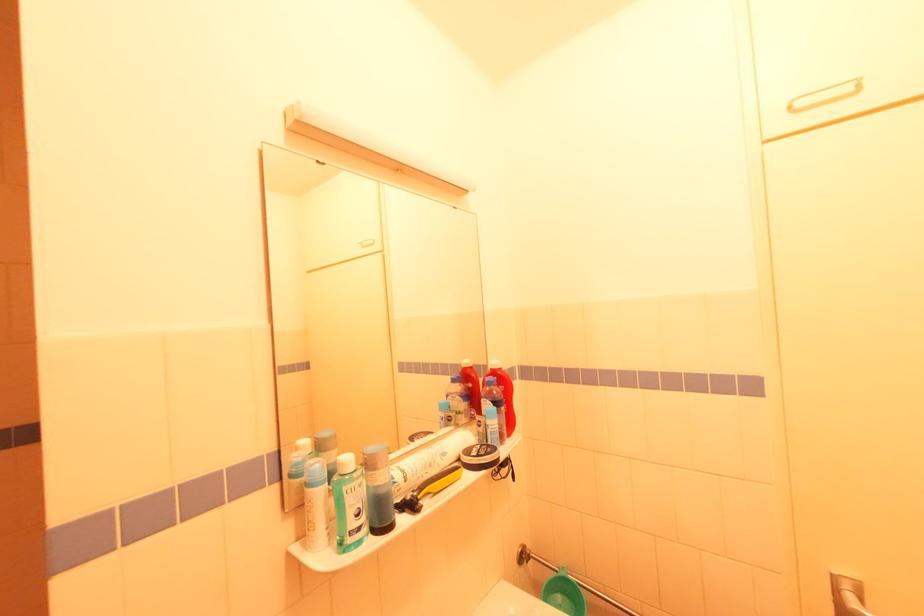
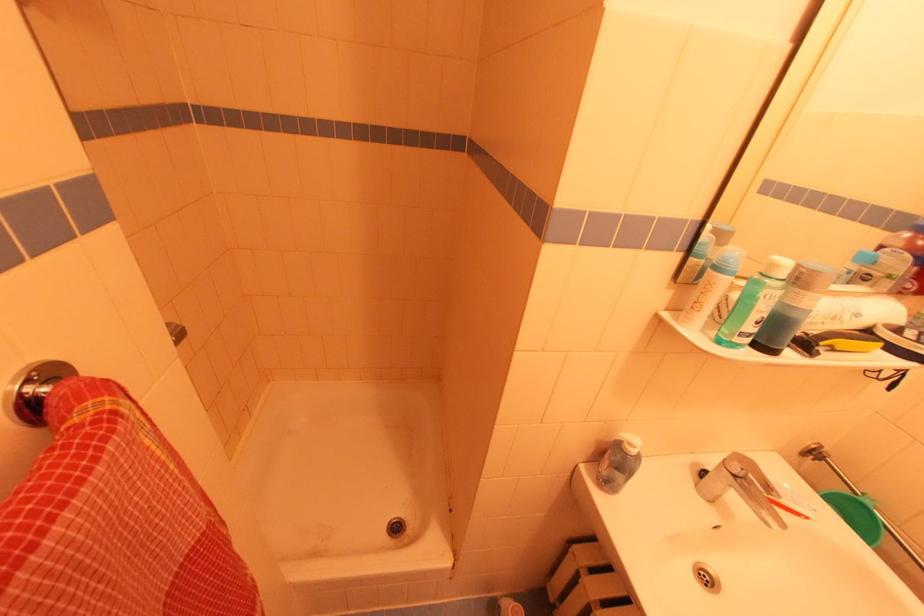
Based on the continuous images, in which direction is the camera rotating?

The camera's rotation is toward left-down.